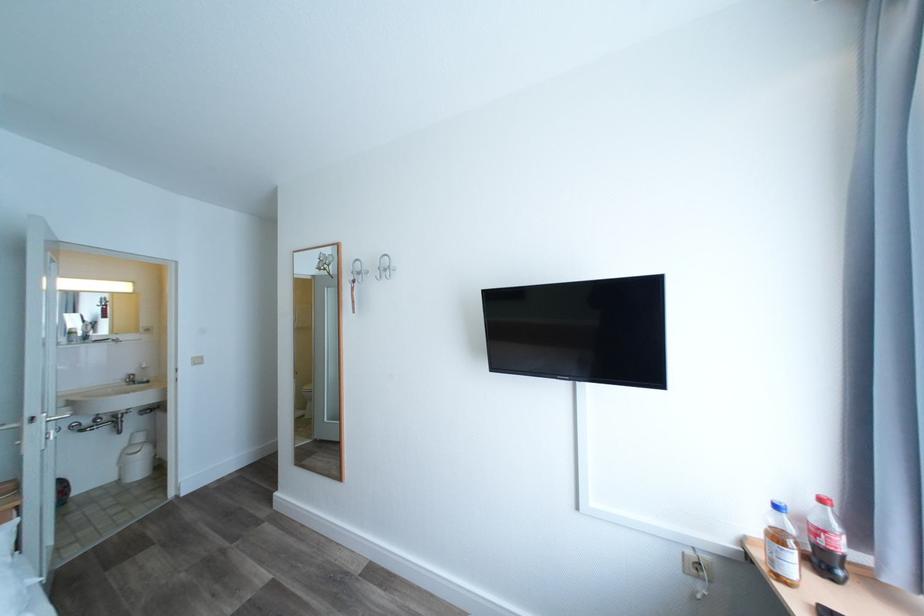
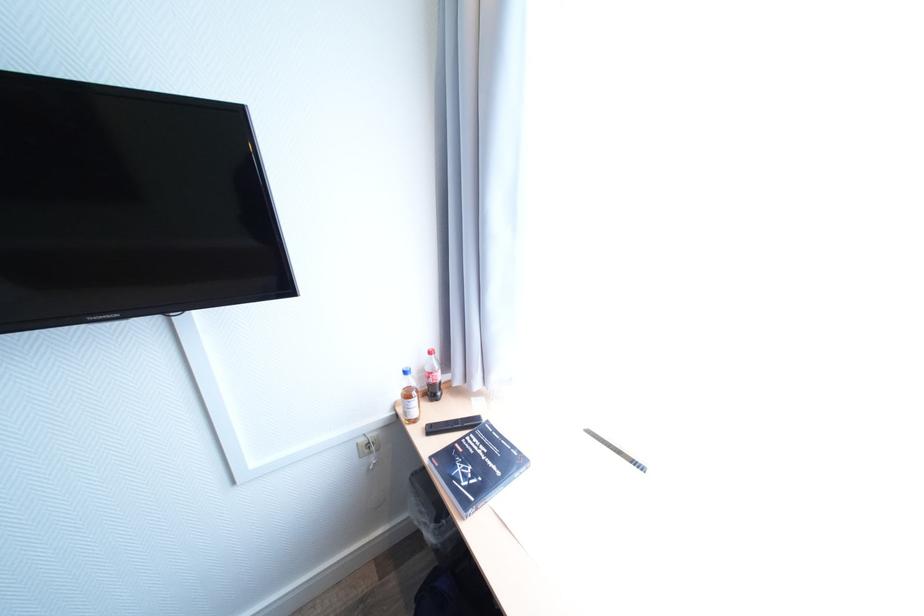
Where in the second image is the point corresponding to (x=752, y=539) from the first image?

(403, 403)